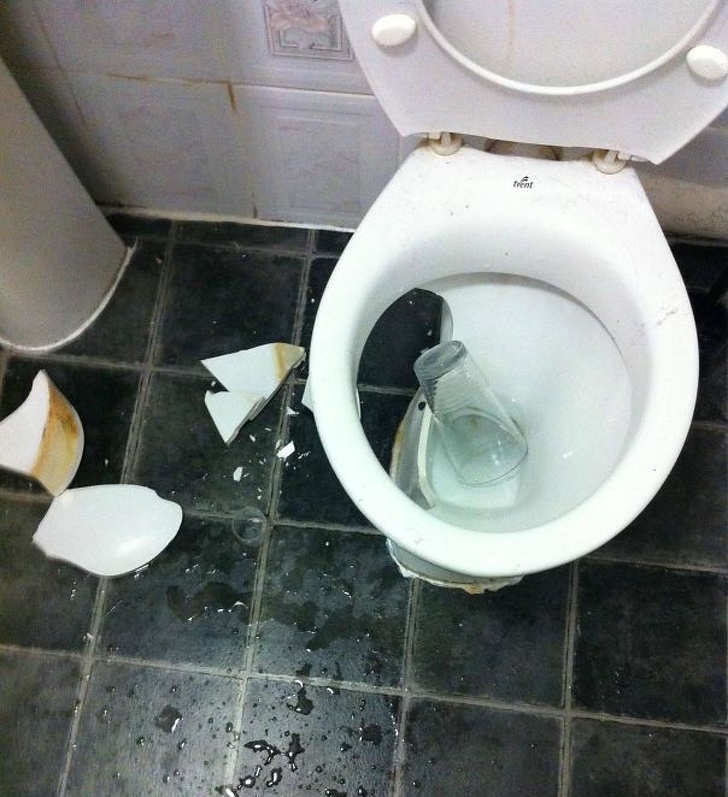
The width and height of the screenshot is (728, 797). In order to click on plastic lid in this screenshot , I will do `click(263, 532)`.